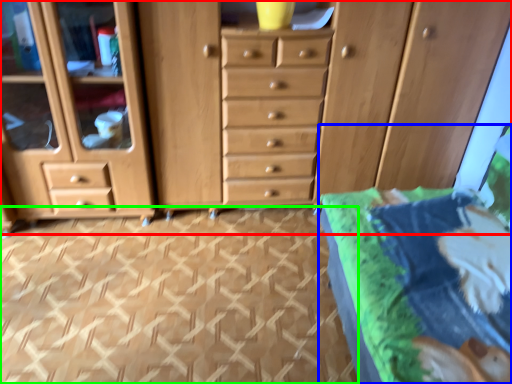
Question: Which object is the closest to the chest of drawers (highlighted by a red box)? Choose among these: bed (highlighted by a blue box) or tile (highlighted by a green box).

Choices:
 (A) bed
 (B) tile

Answer: (B)